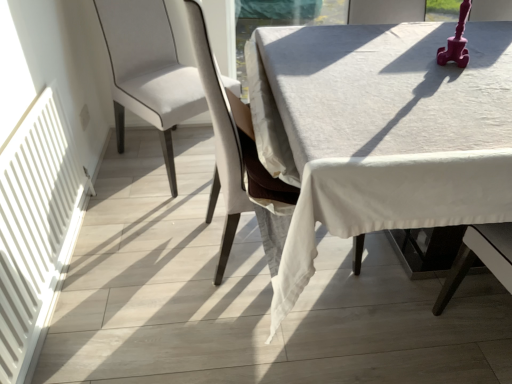
This screenshot has height=384, width=512. Find the location of `free space between satin white chair at center, which is the 1th chair in left-to-right order, and white matte radiator at left`. free space between satin white chair at center, which is the 1th chair in left-to-right order, and white matte radiator at left is located at coordinates (128, 234).